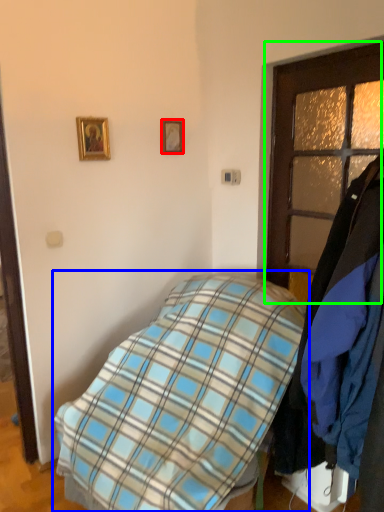
Question: Based on their relative distances, which object is farther from picture frame (highlighted by a red box)? Choose from bed (highlighted by a blue box) and door (highlighted by a green box).

Choices:
 (A) bed
 (B) door

Answer: (A)